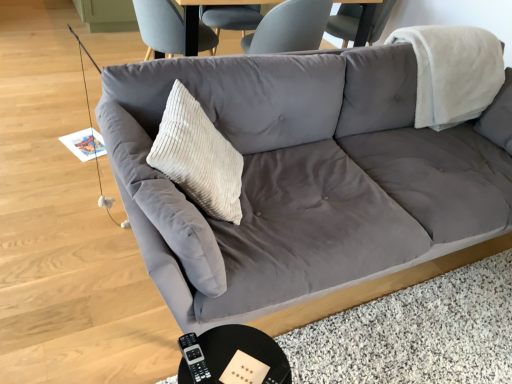
Find the location of a particular element. The image size is (512, 384). free location to the right of black plastic remote at lower center is located at coordinates (242, 361).